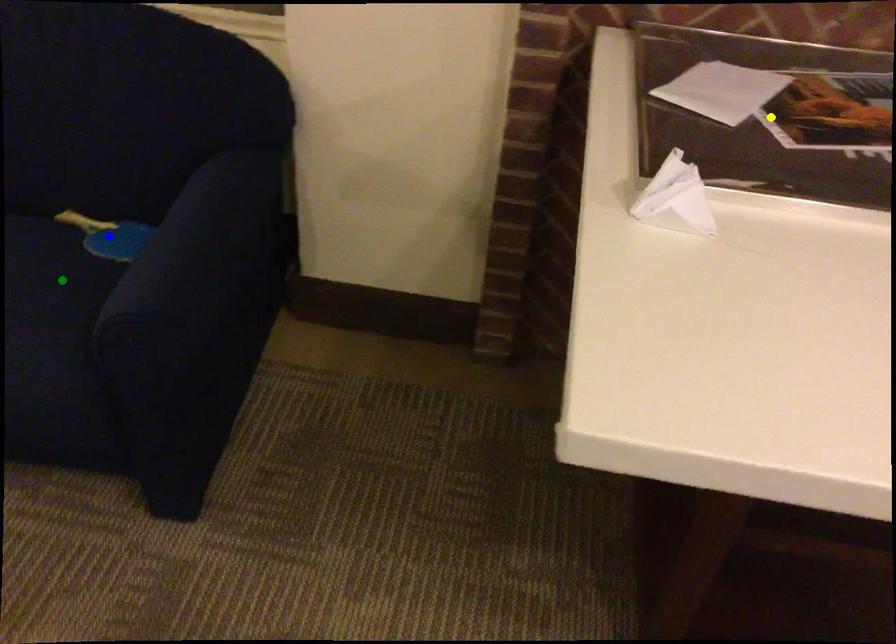
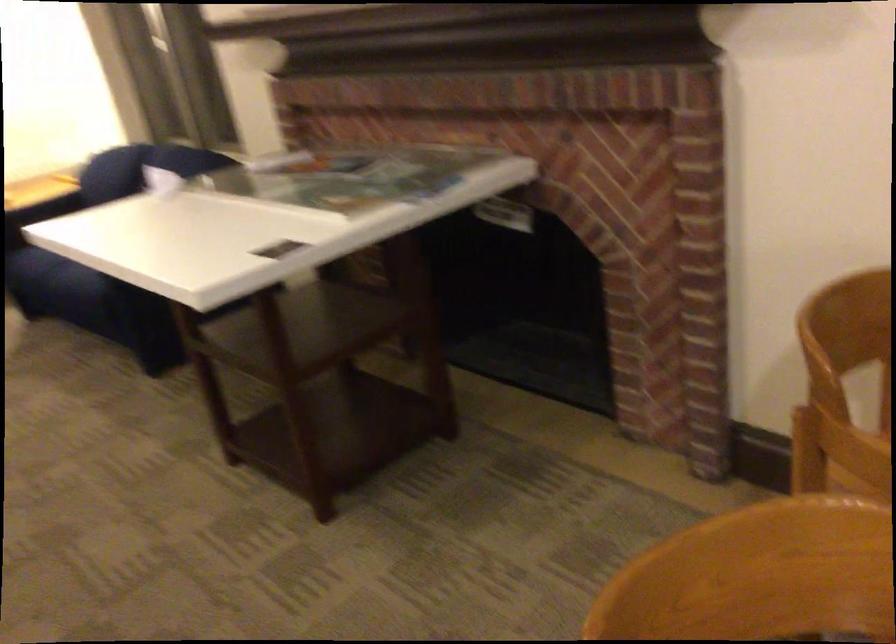
I am providing you with two images of the same scene from different viewpoints. Three points are marked in image1. Which point corresponds to a part or object that is occluded in image2?In image1, three points are marked. Which of them correspond to a part or object that is occluded in image2?Among the three points shown in image1, which one corresponds to a part or object that is no longer visible due to occlusion in image2?

green point, blue point, yellow point